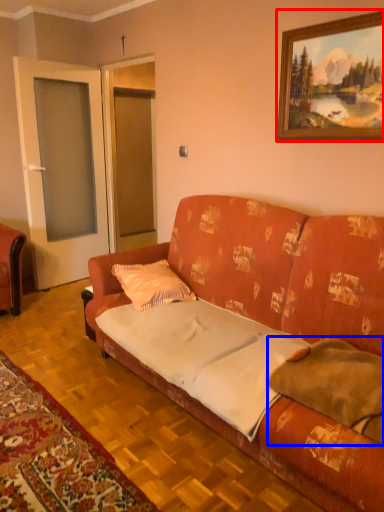
Question: Among these objects, which one is farthest to the camera, picture frame (highlighted by a red box) or pillow (highlighted by a blue box)?

Choices:
 (A) picture frame
 (B) pillow

Answer: (A)